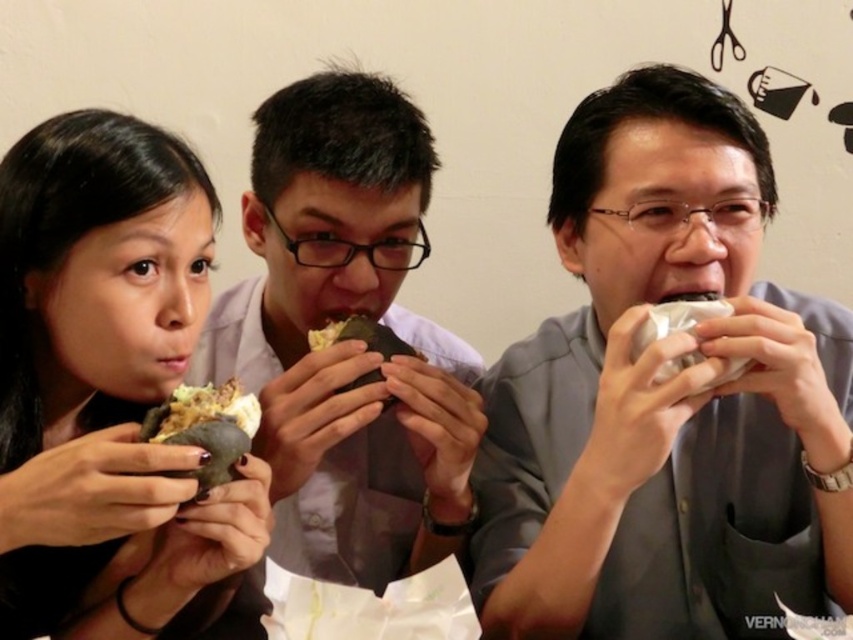
Is the position of matte black sandwich at left less distant than that of matte black sandwich at center?

Yes, matte black sandwich at left is closer to the viewer.

Who is lower down, matte black sandwich at left or matte black sandwich at center?

matte black sandwich at left

Measure the distance between point (189, 269) and camera.

They are 31.34 inches apart.

The image size is (853, 640). Identify the location of matte black sandwich at left. (111, 392).

Can you confirm if white paper food at center is thinner than brown matte sandwich at center?

Yes.

Does white paper food at center appear over brown matte sandwich at center?

Indeed, white paper food at center is positioned over brown matte sandwich at center.

Identify the location of white paper food at center. (675, 320).

This screenshot has height=640, width=853. Identify the location of white paper food at center. (675, 320).

Can you confirm if matte black sandwich at left is bigger than crumbly white bread at center?

Indeed, matte black sandwich at left has a larger size compared to crumbly white bread at center.

Where is `matte black sandwich at left`? The image size is (853, 640). matte black sandwich at left is located at coordinates (111, 392).